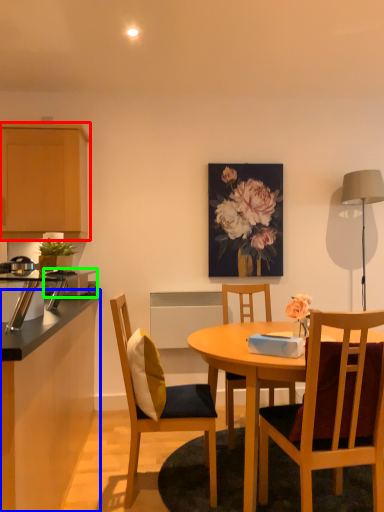
Question: Estimate the real-world distances between objects in this image. Which object is closer to cabinetry (highlighted by a red box), cabinetry (highlighted by a blue box) or appliance (highlighted by a green box)?

Choices:
 (A) cabinetry
 (B) appliance

Answer: (B)